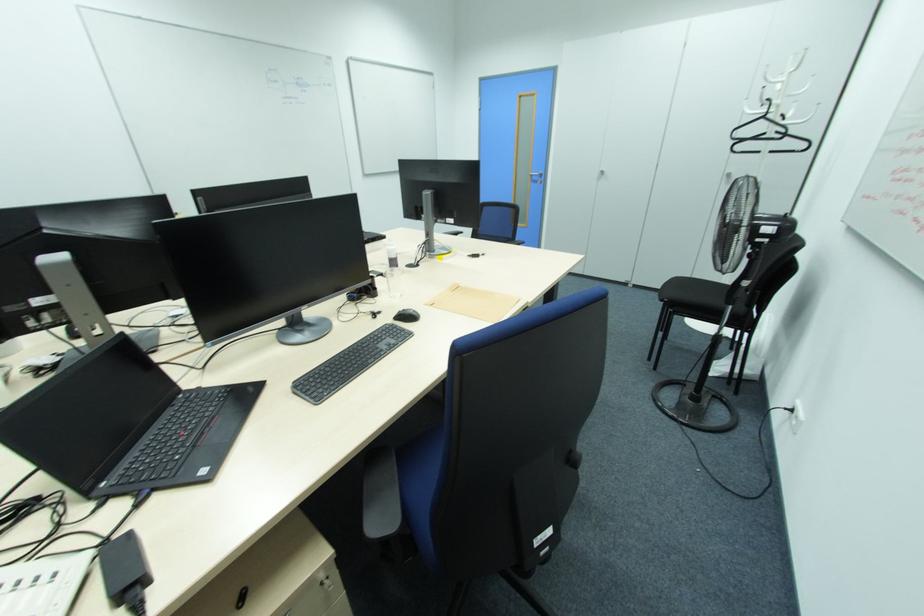
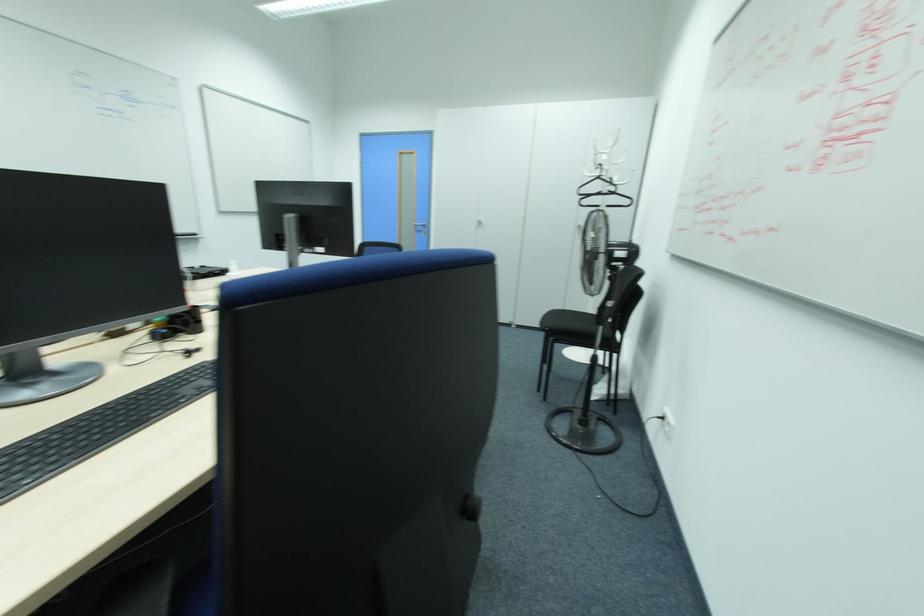
Where in the second image is the point corresponding to (x=764, y=118) from the first image?

(599, 177)